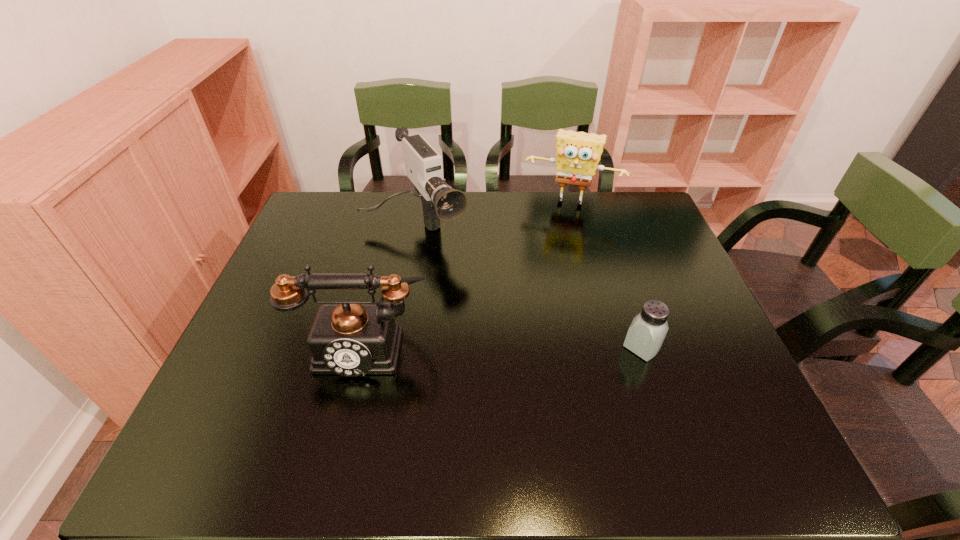
Find the location of a particular element. This screenshot has height=540, width=960. vacant space located on the face of the sponge is located at coordinates (552, 234).

Identify the location of vacant space located on the face of the sponge. (535, 291).

The image size is (960, 540). Find the location of `camcorder that is at the far edge`. camcorder that is at the far edge is located at coordinates (423, 164).

Find the location of `sponge at the far edge`. sponge at the far edge is located at coordinates (578, 153).

At what (x,y) coordinates should I click in order to perform the action: click on object that is at the left edge. Please return your answer as a coordinate pair (x, y). Looking at the image, I should click on (348, 338).

Where is `saltshaker situated at the right edge`? The width and height of the screenshot is (960, 540). saltshaker situated at the right edge is located at coordinates coord(645,336).

This screenshot has width=960, height=540. Identify the location of sponge present at the right edge. (578, 153).

Where is `object at the far right corner`? This screenshot has width=960, height=540. object at the far right corner is located at coordinates (578, 153).

Locate an element on the screen. free space at the far edge of the desktop is located at coordinates (362, 221).

The width and height of the screenshot is (960, 540). What are the coordinates of `vacant space at the near edge of the desktop` in the screenshot? It's located at coord(495,421).